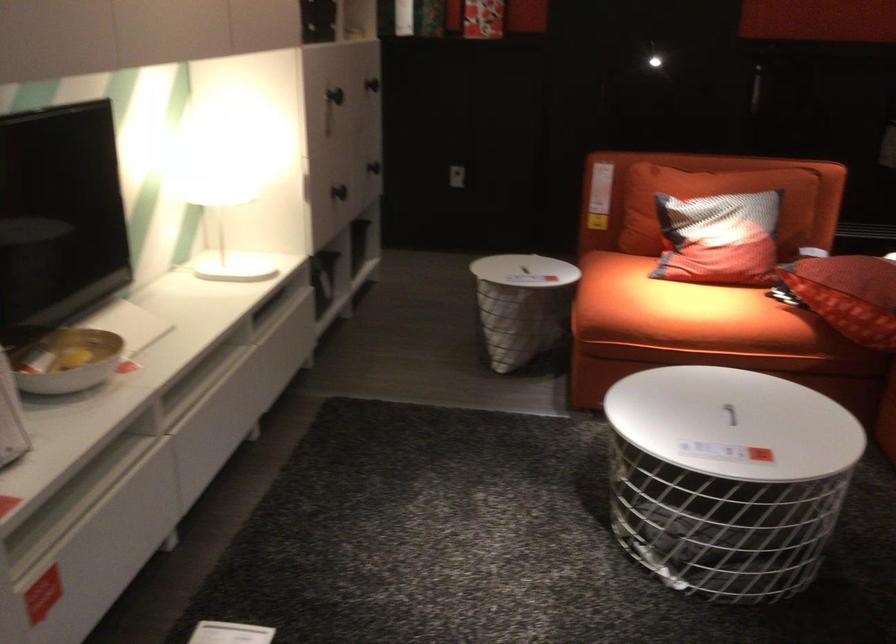
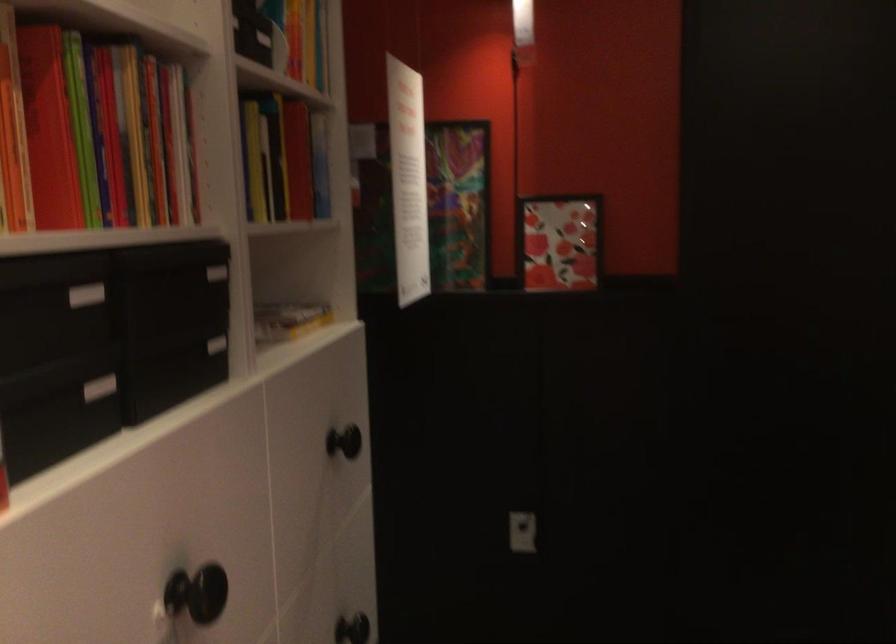
Question: In a continuous first-person perspective shot, in which direction is the camera moving?

Choices:
 (A) Left
 (B) Right
 (C) Forward
 (D) Backward

Answer: (C)